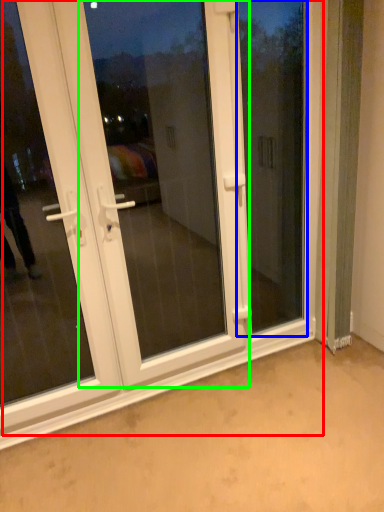
Question: Which is nearer to the door (highlighted by a red box)? window screen (highlighted by a blue box) or screen door (highlighted by a green box).

Choices:
 (A) window screen
 (B) screen door

Answer: (A)